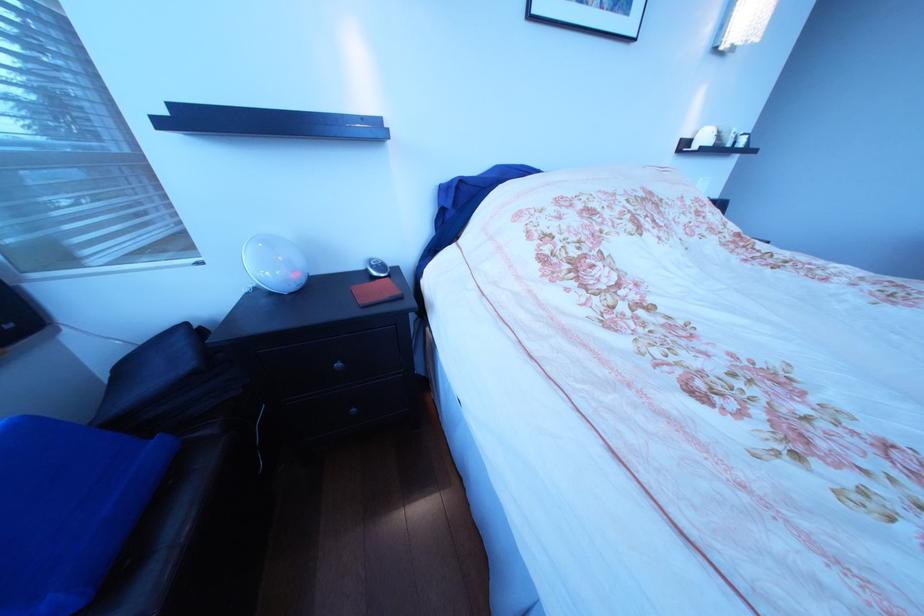
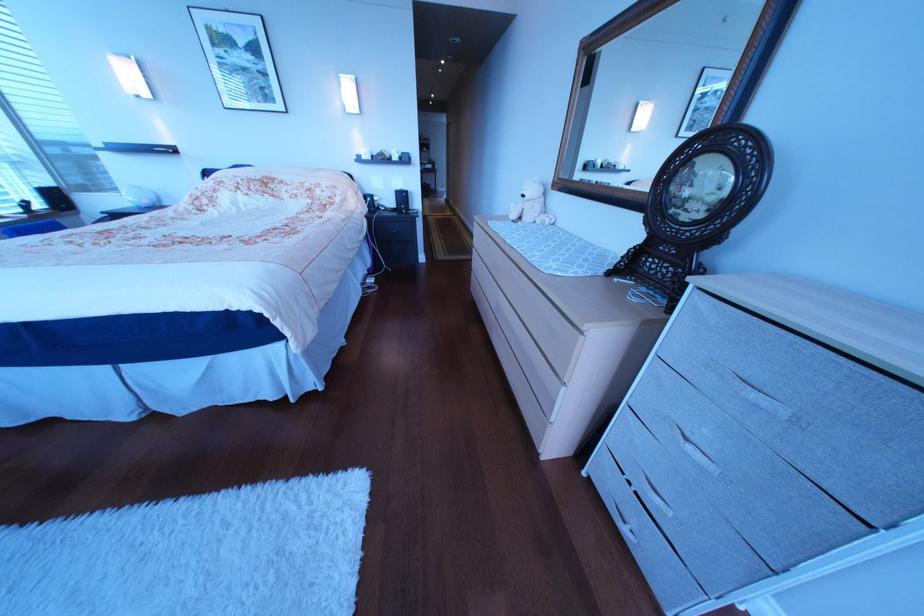
Question: Which direction would the cameraman need to move to produce the second image? Reply with the corresponding letter.

Choices:
 (A) Left
 (B) Right
 (C) Forward
 (D) Backward

Answer: (B)